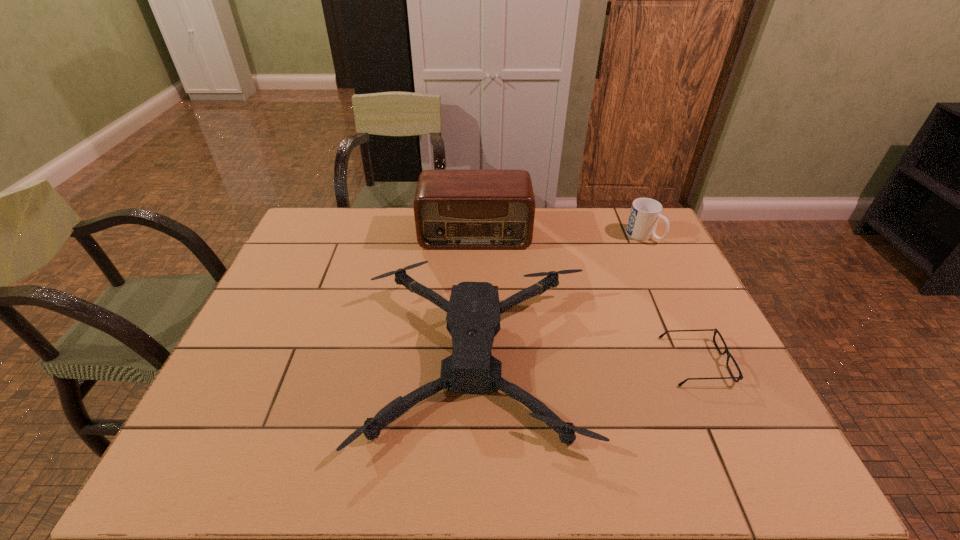
The height and width of the screenshot is (540, 960). Find the location of `unoccupied area between the third tallest object and the spectacles`. unoccupied area between the third tallest object and the spectacles is located at coordinates (587, 360).

Locate an element on the screen. Image resolution: width=960 pixels, height=540 pixels. blank region between the third tallest object and the mug is located at coordinates (561, 296).

Locate an element on the screen. vacant space that's between the shortest object and the second shortest object is located at coordinates (587, 360).

Identify the location of free space between the shortest object and the mug. (670, 298).

At what (x,y) coordinates should I click in order to perform the action: click on vacant area that lies between the radio receiver and the mug. Please return your answer as a coordinate pair (x, y). The width and height of the screenshot is (960, 540). Looking at the image, I should click on (559, 234).

Locate an element on the screen. free area in between the third tallest object and the spectacles is located at coordinates (587, 360).

Find the location of a particular element. This screenshot has width=960, height=540. vacant area that lies between the mug and the shortest object is located at coordinates (670, 298).

Where is `free spot between the mug and the third tallest object`? This screenshot has height=540, width=960. free spot between the mug and the third tallest object is located at coordinates (561, 296).

Locate which object ranks in proximity to the mug. Please provide its 2D coordinates. Your answer should be formatted as a tuple, i.e. [(x, y)], where the tuple contains the x and y coordinates of a point satisfying the conditions above.

[(473, 318)]

At what (x,y) coordinates should I click in order to perform the action: click on object identified as the third closest to the spectacles. Please return your answer as a coordinate pair (x, y). Looking at the image, I should click on [x=453, y=209].